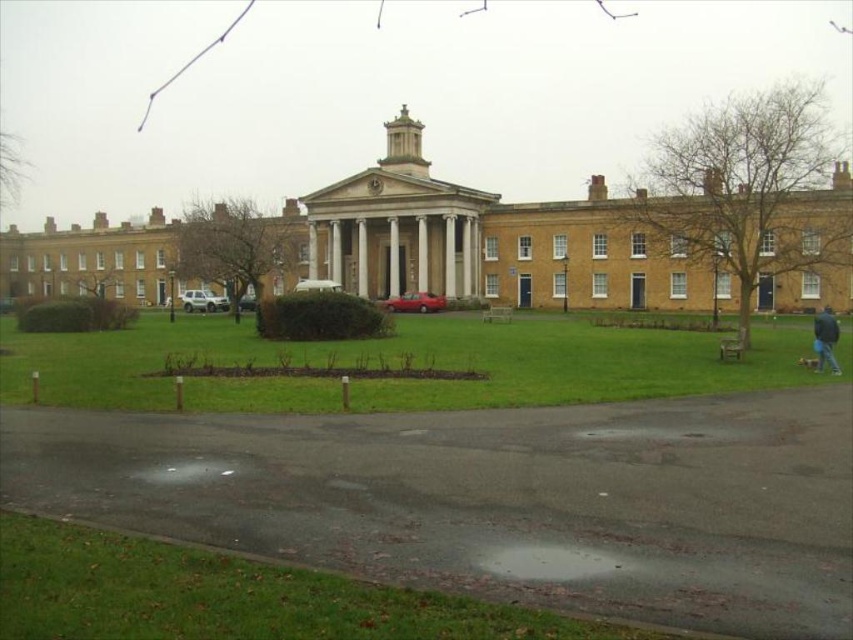
You are a gardener who needs to mow the lawn around the classical building. You notice two patches of green grass at lower center and green grass at lower left. Which area requires immediate attention to maintain an even height?

The green grass at lower center requires immediate attention because it has a greater height compared to the green grass at lower left, indicating it needs to be mowed sooner to maintain an even appearance.

You are standing in front of the classical building and want to place the blue fabric jacket at lower right on the green grass at lower center. Can you fit the jacket on the grass area without overlapping the edges?

The green grass at lower center has a larger width than the blue fabric jacket at lower right, so yes, the jacket can be placed on the grass area without overlapping the edges.